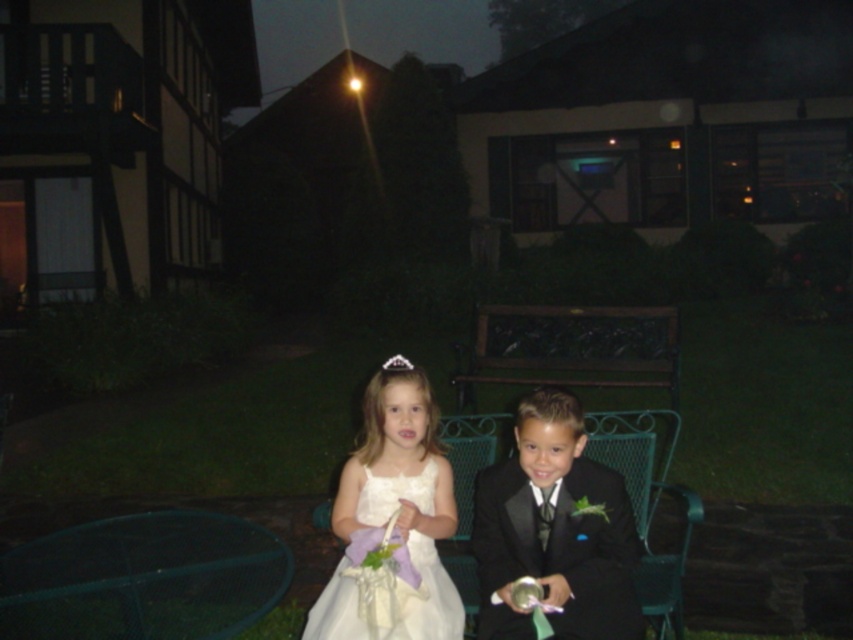
Can you confirm if shiny black suit at center is positioned below white satin dress at center?

No, shiny black suit at center is not below white satin dress at center.

Measure the distance from shiny black suit at center to white satin dress at center.

They are 14.54 inches apart.

Find the location of `shiny black suit at center`. shiny black suit at center is located at coordinates (554, 529).

Where is `shiny black suit at center`? shiny black suit at center is located at coordinates (554, 529).